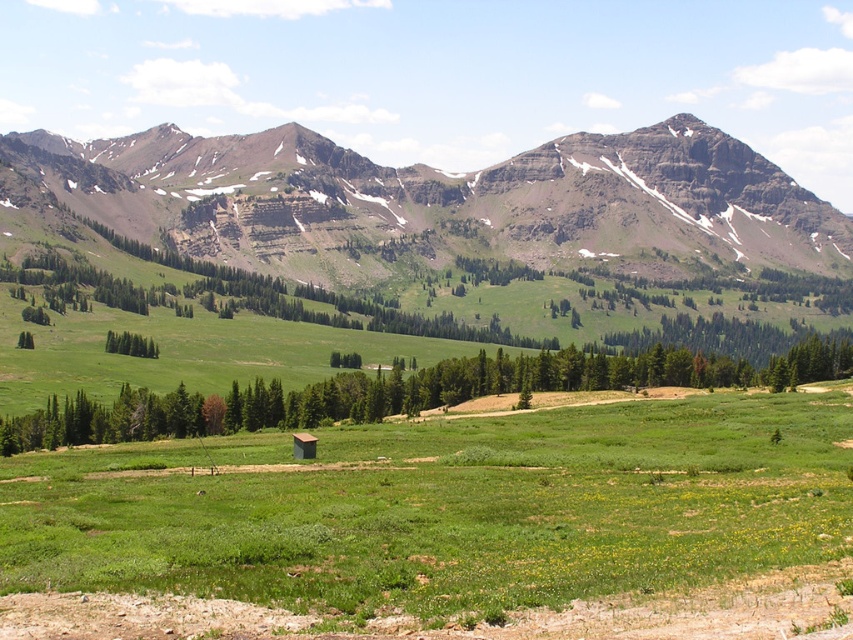
Is rocky brown mountain range at upper center taller than green leafy tree at center?

Yes, rocky brown mountain range at upper center is taller than green leafy tree at center.

Who is more forward, (491, 240) or (132, 397)?

Point (132, 397) is in front.

Where is `rocky brown mountain range at upper center`? The width and height of the screenshot is (853, 640). rocky brown mountain range at upper center is located at coordinates (444, 198).

Locate an element on the screen. The width and height of the screenshot is (853, 640). rocky brown mountain range at upper center is located at coordinates (444, 198).